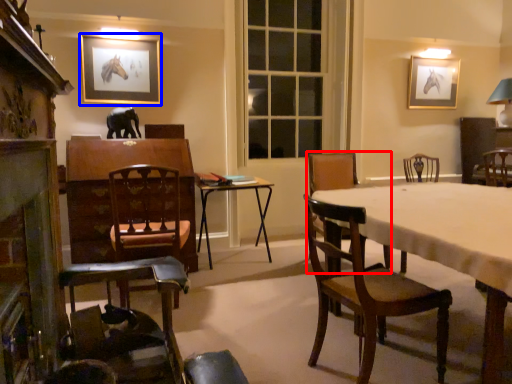
Question: Which object appears closest to the camera in this image, chair (highlighted by a red box) or picture frame (highlighted by a blue box)?

Choices:
 (A) chair
 (B) picture frame

Answer: (A)